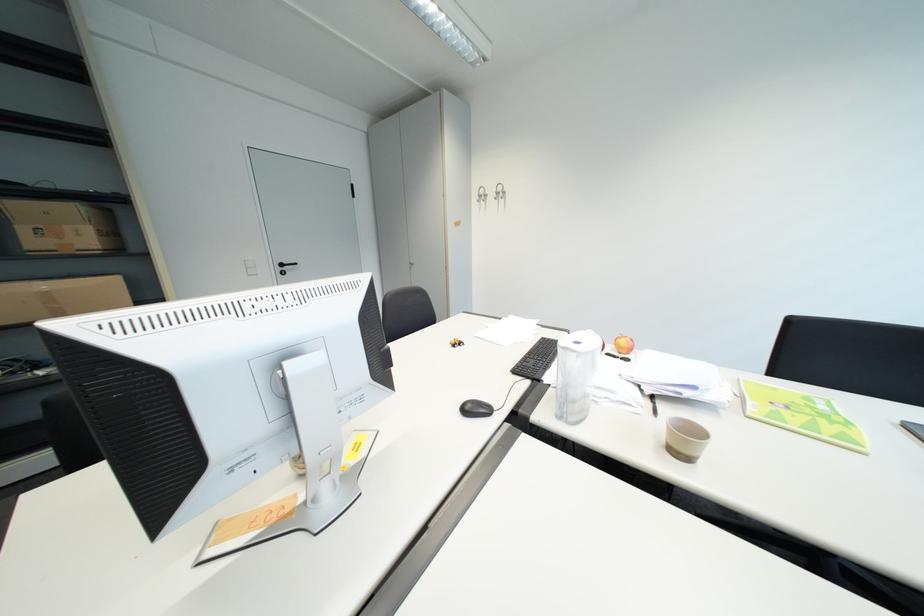
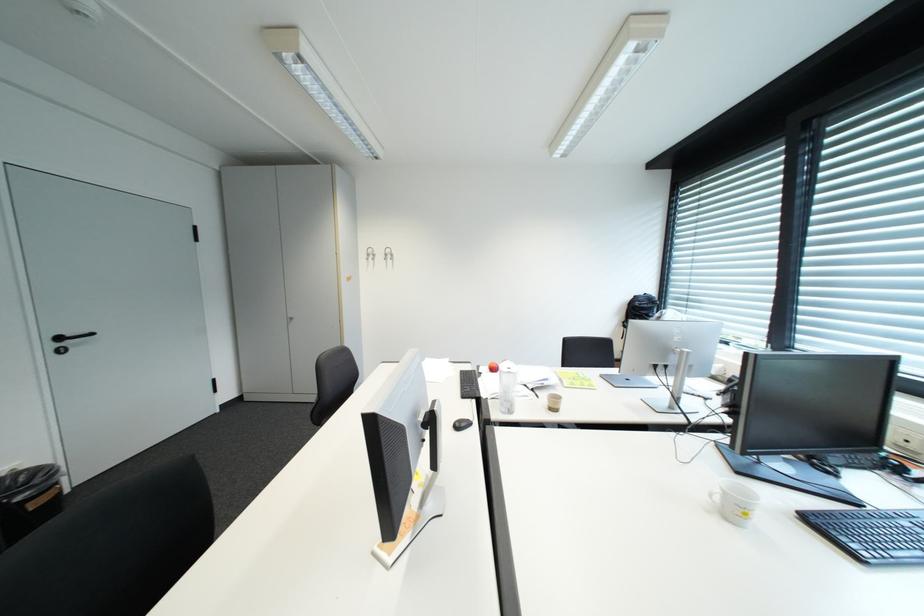
Question: The first image is from the beginning of the video and the second image is from the end. How did the camera likely rotate when shooting the video?

Choices:
 (A) Left
 (B) Right
 (C) Up
 (D) Down

Answer: (B)